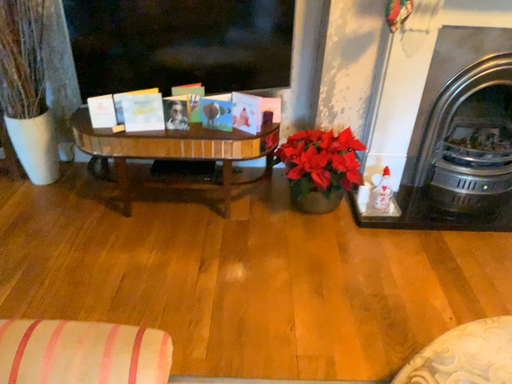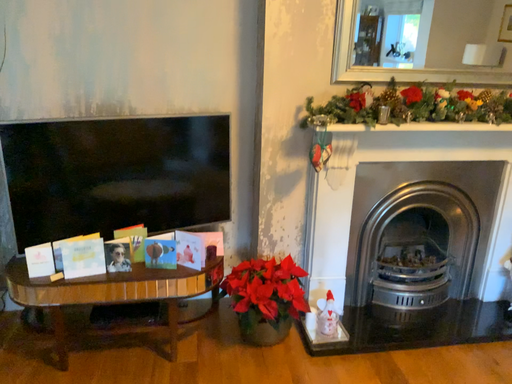
Question: Which way did the camera rotate in the video?

Choices:
 (A) rotated left
 (B) rotated right

Answer: (B)